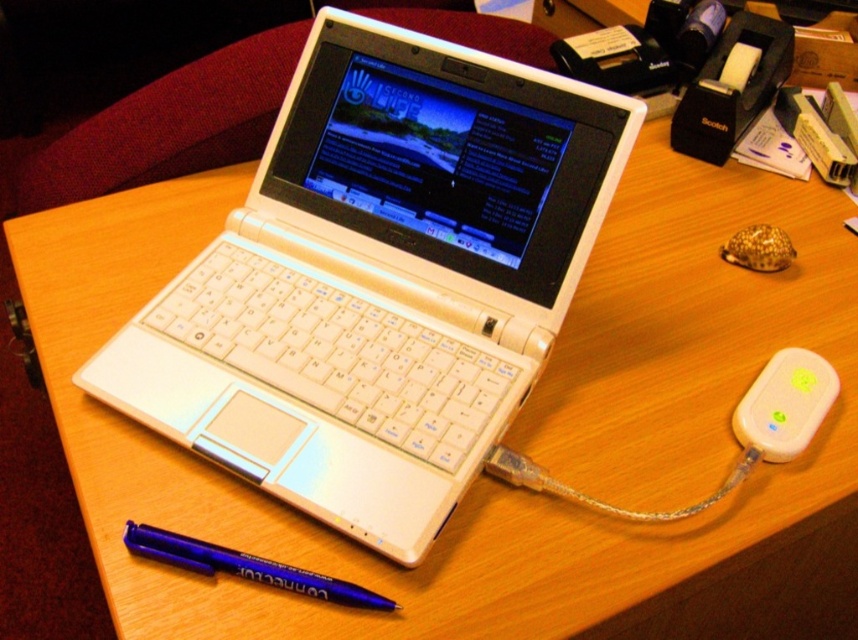
You are organizing your desk and need to place both the white plastic laptop at center and the white plastic ipod at right into a storage box. The box can only fit items that are narrower than 30 cm. Based on their widths, can both items fit into the box?

The white plastic laptop at center might be wider than white plastic ipod at right. Since the box requires items to be narrower than 30 cm, it is uncertain if both can fit without knowing the exact width of the laptop.

You are organizing your desk and want to stack the white plastic laptop at center on top of the white plastic ipod at right. Is this possible based on their sizes?

The white plastic laptop at center has a greater height compared to the white plastic ipod at right. Therefore, stacking the white plastic laptop at center on top of the white plastic ipod at right would not be possible due to the laptop being taller.